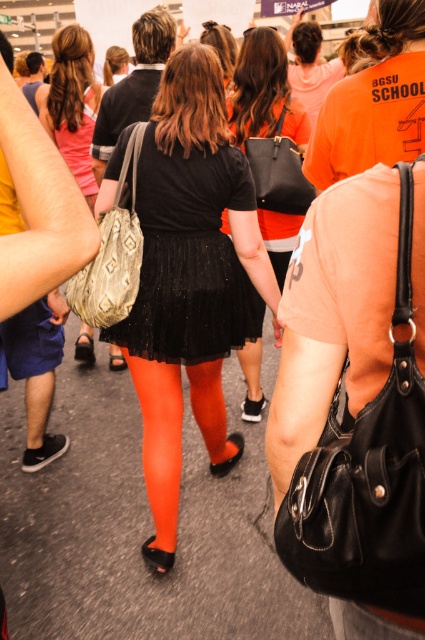
Question: Which is farther from the matte black purse at center?

Choices:
 (A) black glittery skirt at center
 (B) orange matte shirt at center

Answer: (B)

Question: Which of the following is the closest to the observer?

Choices:
 (A) orange matte shirt at center
 (B) black glittery skirt at center
 (C) matte black purse at center
 (D) black glitter skirt at center

Answer: (A)

Question: Which point appears closest to the camera in this image?

Choices:
 (A) (240, 314)
 (B) (393, 104)

Answer: (B)

Question: Is black glittery skirt at center smaller than orange matte shirt at center?

Choices:
 (A) yes
 (B) no

Answer: (B)

Question: Does black glittery skirt at center lie behind orange matte shirt at center?

Choices:
 (A) no
 (B) yes

Answer: (B)

Question: In this image, where is orange matte shirt at center located relative to matte black purse at center?

Choices:
 (A) right
 (B) left

Answer: (A)